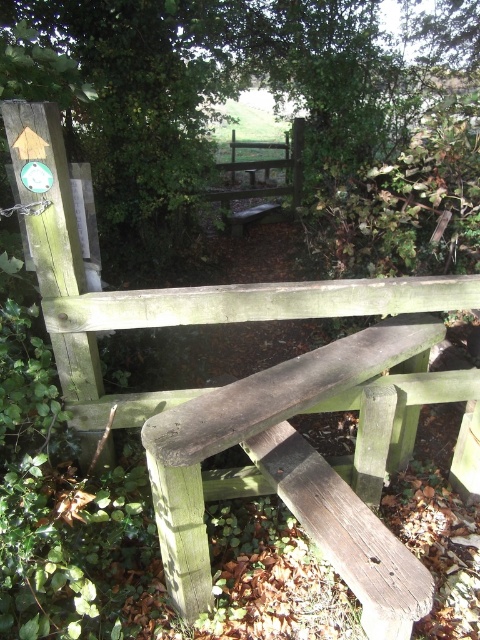
You are sitting on the dark brown wood bench at center and want to rest under some shade. Is there a green leafy tree at upper left that can provide shade over you?

The green leafy tree at upper left is positioned over the dark brown wood bench at center, so yes, it can provide shade for you while sitting there.

You are standing at the base of the stile and want to reach the green leafy tree at upper left. The stile is 10 feet tall. Can you climb over the stile to get closer to the tree?

The green leafy tree at upper left is 11.30 feet away from the camera. Since the stile is only 10 feet tall, you can climb over it to get closer to the tree.